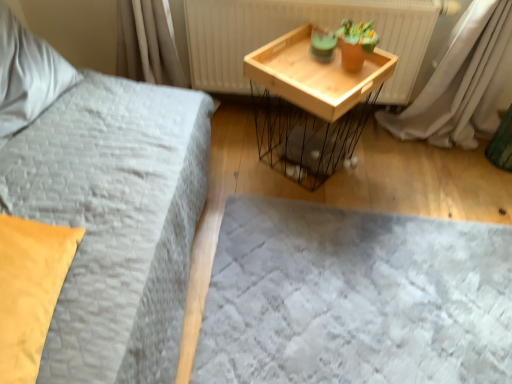
At what (x,y) coordinates should I click in order to perform the action: click on vacant location below wooden tray at upper right (from a real-world perspective). Please return your answer as a coordinate pair (x, y). Image resolution: width=512 pixels, height=384 pixels. Looking at the image, I should click on (308, 117).